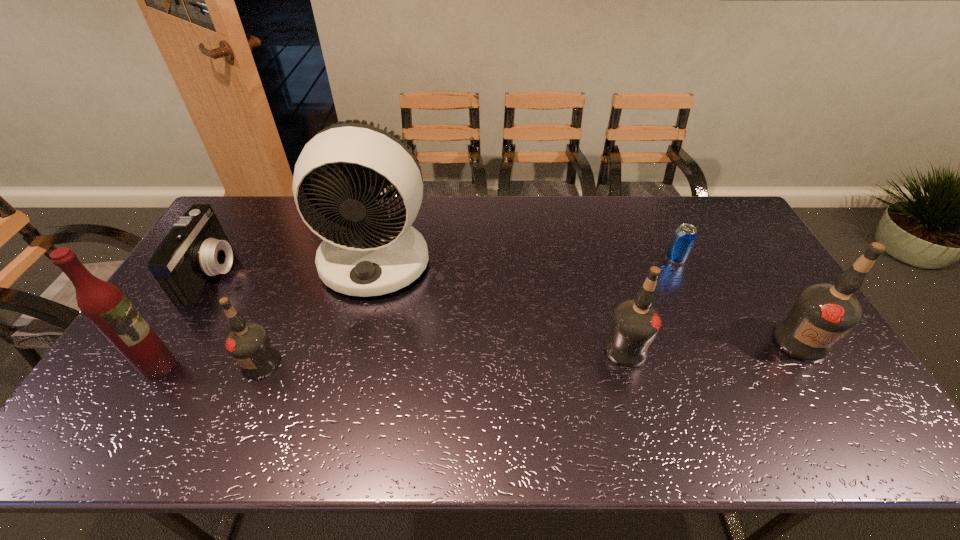
Locate an element on the screen. This screenshot has width=960, height=540. object situated at the right edge is located at coordinates (822, 313).

Image resolution: width=960 pixels, height=540 pixels. Identify the location of object present at the near left corner. (104, 304).

You are a GUI agent. You are given a task and a screenshot of the screen. Output one action in this format:
    pyautogui.click(x=<x>, y=<y>)
    Task: Click on the blank space at the far edge of the desktop
    This screenshot has width=960, height=540.
    Given the screenshot: What is the action you would take?
    pyautogui.click(x=666, y=219)

The width and height of the screenshot is (960, 540). Find the location of `free space at the right edge of the desktop`. free space at the right edge of the desktop is located at coordinates (757, 312).

This screenshot has height=540, width=960. I want to click on free point between the fan and the rightmost object, so click(x=588, y=301).

Where is `unoccupied position between the rightmost object and the camcorder`? unoccupied position between the rightmost object and the camcorder is located at coordinates (507, 307).

Locate an element on the screen. This screenshot has width=960, height=540. free spot between the fan and the leftmost vodka is located at coordinates (319, 312).

You are a GUI agent. You are given a task and a screenshot of the screen. Output one action in this format:
    pyautogui.click(x=<x>, y=<y>)
    Task: Click on the free space between the sixth tallest object and the second tallest vodka
    
    Given the screenshot: What is the action you would take?
    pyautogui.click(x=420, y=311)

Find the location of a particular element. The width and height of the screenshot is (960, 540). vacant area between the fourth tallest object and the camcorder is located at coordinates (420, 311).

Where is `free space that is in between the second shortest object and the second vodka from right to left`? The image size is (960, 540). free space that is in between the second shortest object and the second vodka from right to left is located at coordinates (420, 311).